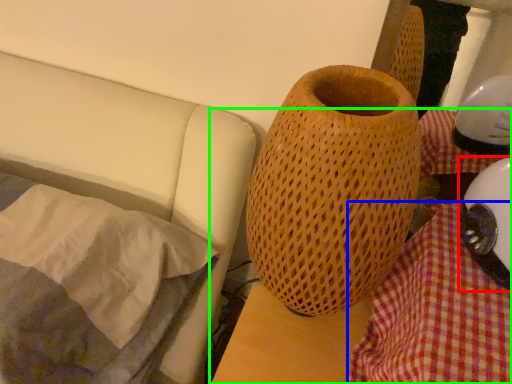
Question: Which is farther away from helmet (highlighted by a red box)? blanket (highlighted by a blue box) or table (highlighted by a green box)?

Choices:
 (A) blanket
 (B) table

Answer: (B)